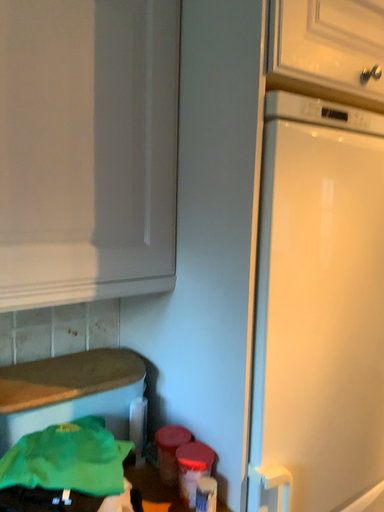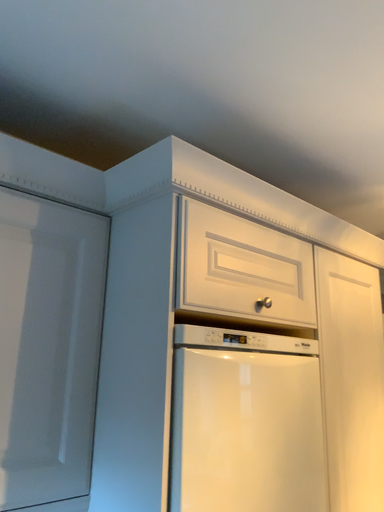
Question: Which way did the camera rotate in the video?

Choices:
 (A) rotated upward
 (B) rotated downward

Answer: (A)